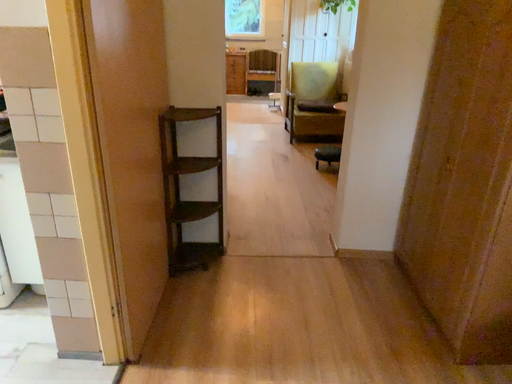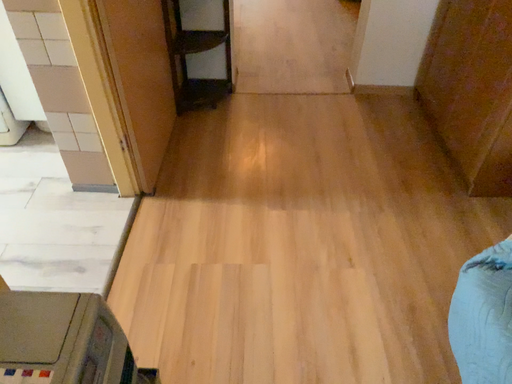
Question: How did the camera likely rotate when shooting the video?

Choices:
 (A) rotated upward
 (B) rotated downward

Answer: (B)